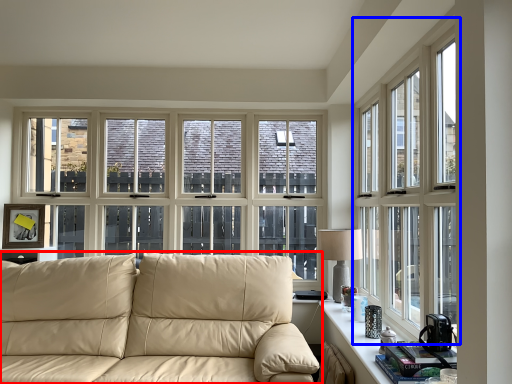
Question: Which point is closer to the camera, studio couch (highlighted by a red box) or window (highlighted by a blue box)?

Choices:
 (A) studio couch
 (B) window

Answer: (B)